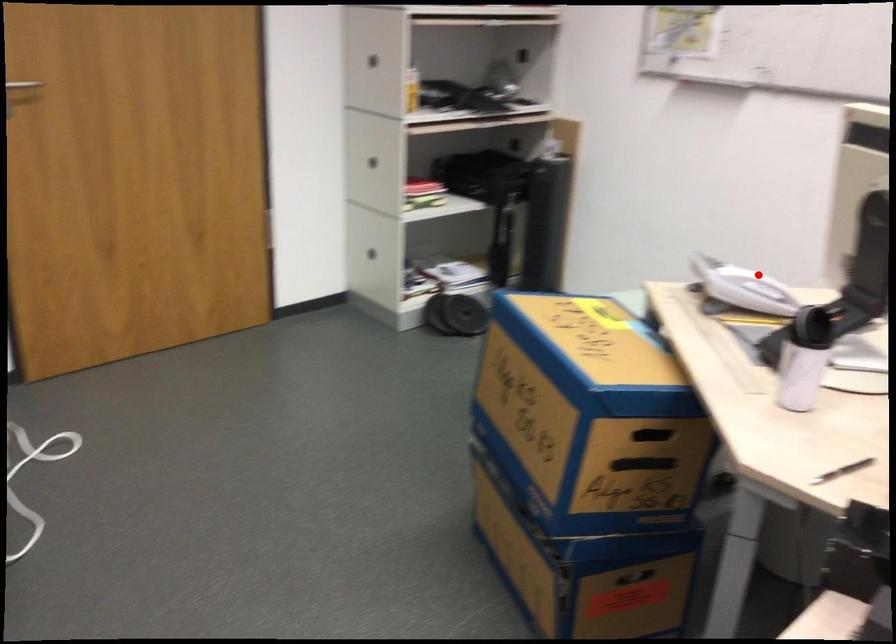
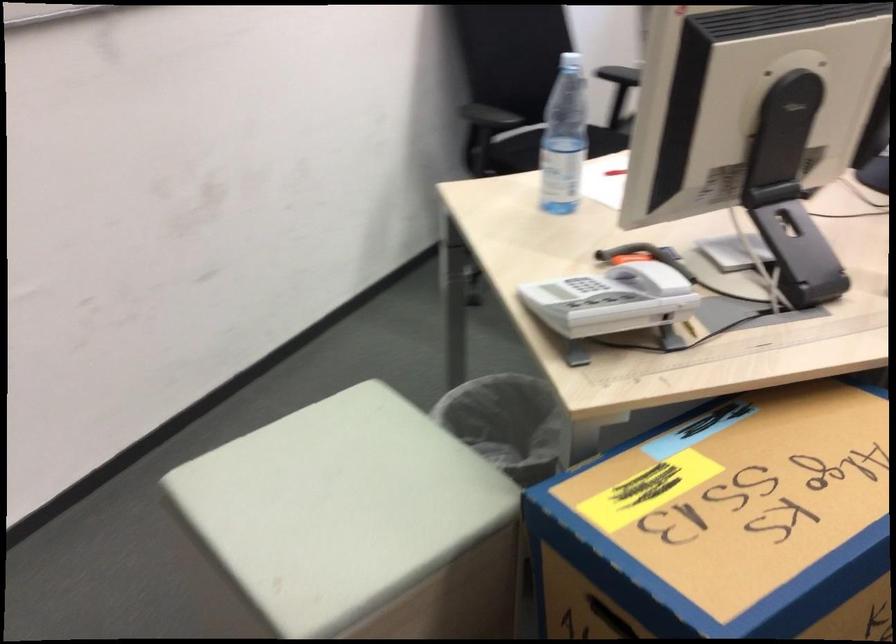
The point at the highlighted location is marked in the first image. Where is the corresponding point in the second image?

(648, 268)